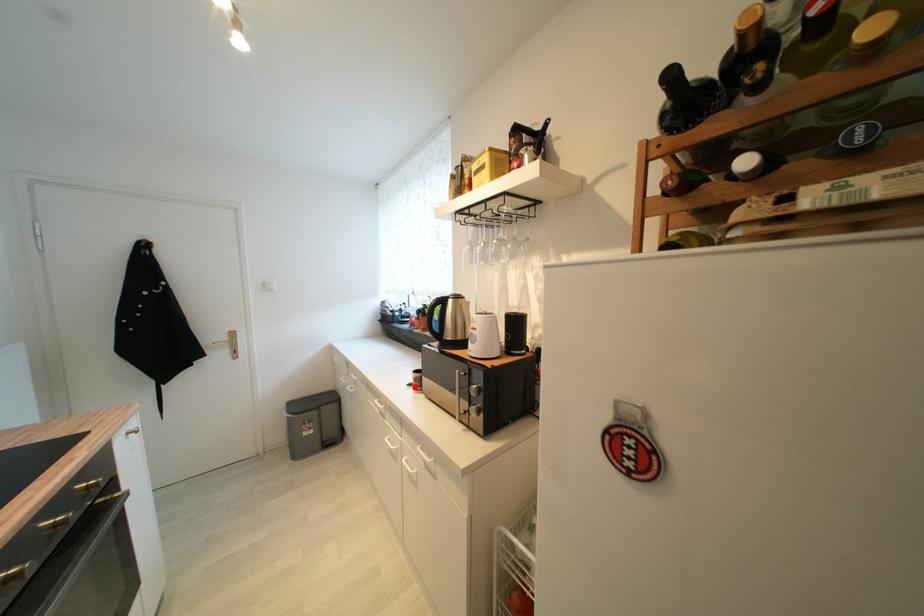
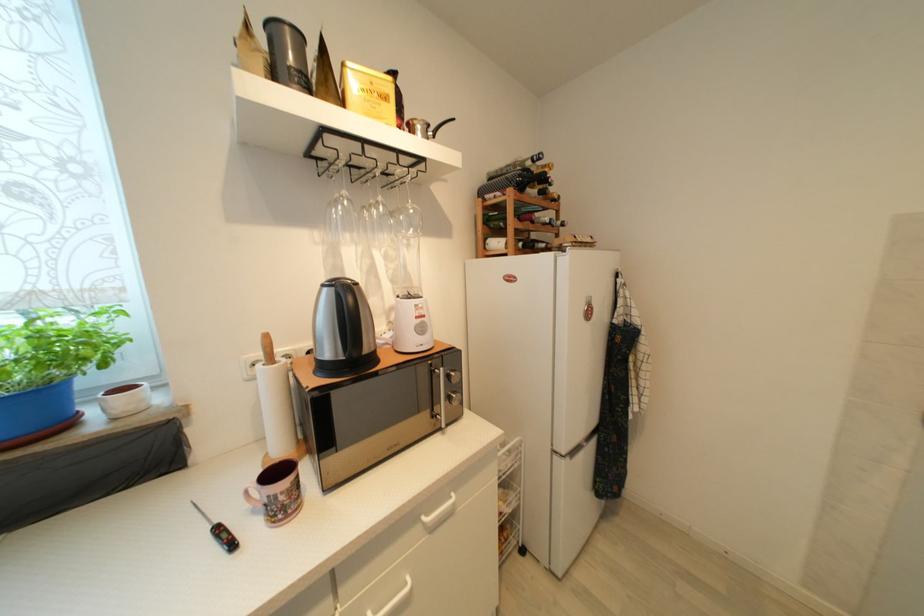
Find the pixel in the second image that matches the highlighted location in the first image.

(237, 546)